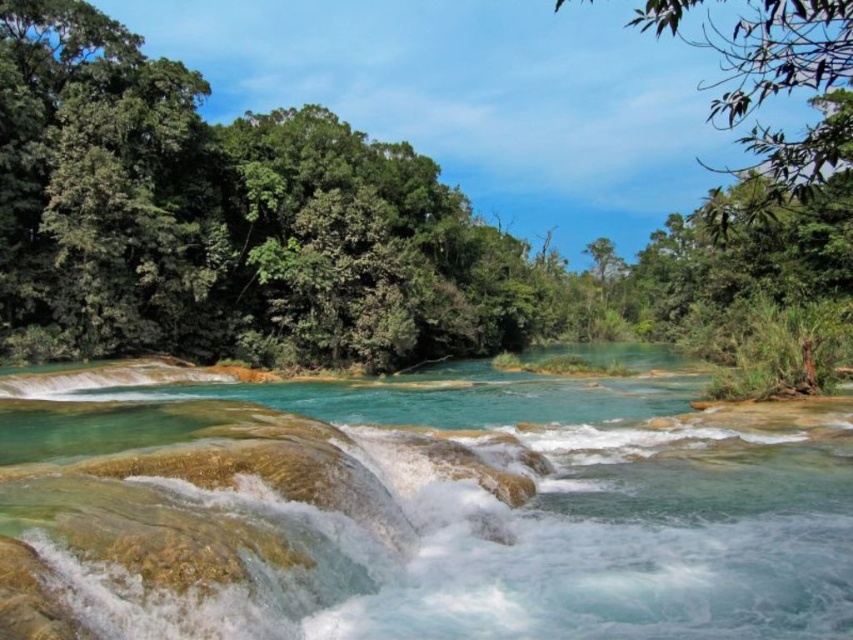
Is green leafy tree at center below clear water at center?

No, green leafy tree at center is not below clear water at center.

Does point (45, 186) lie behind point (558, 387)?

Yes, it is behind point (558, 387).

The height and width of the screenshot is (640, 853). What are the coordinates of `green leafy tree at center` in the screenshot? It's located at (234, 224).

At what (x,y) coordinates should I click in order to perform the action: click on green leafy tree at center. Please return your answer as a coordinate pair (x, y). Looking at the image, I should click on (234, 224).

What do you see at coordinates (234, 224) in the screenshot? I see `green leafy tree at center` at bounding box center [234, 224].

Is green leafy tree at center to the left of green leafy tree at upper right from the viewer's perspective?

Correct, you'll find green leafy tree at center to the left of green leafy tree at upper right.

Between point (737, 291) and point (837, 154), which one is positioned behind?

The point (737, 291) is more distant.

The height and width of the screenshot is (640, 853). Find the location of `green leafy tree at center`. green leafy tree at center is located at coordinates (234, 224).

Who is shorter, clear water at center or green leafy tree at upper right?

clear water at center is shorter.

Measure the distance between clear water at center and camera.

clear water at center is 22.12 feet from camera.

Which is behind, point (337, 424) or point (828, 19)?

The point (337, 424) is more distant.

You are a GUI agent. You are given a task and a screenshot of the screen. Output one action in this format:
    pyautogui.click(x=<x>, y=<y>)
    Task: Click on the clear water at center
    
    Given the screenshot: What is the action you would take?
    pyautogui.click(x=498, y=516)